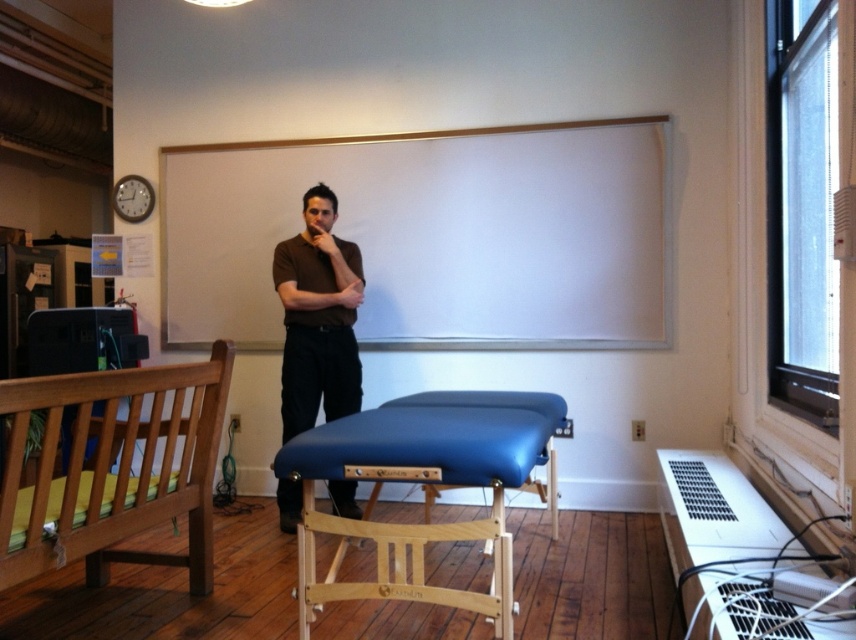
You are a physical therapist trying to adjust the position of your patient. The patient is wearing a dark brown shirt at center and has a matte brown arm at center. You need to ensure that the distance between them is exactly 3 inches for proper alignment. Is the current distance sufficient?

The distance between the dark brown shirt at center and the matte brown arm at center is currently 2.57 inches, which is slightly less than the required 3 inches. Adjust the position to increase the distance for proper alignment.

You are a physical therapist entering the room and need to move the blue fabric massage table at center so that it doesn not block the matte brown arm at center. Can you move the table to the side without moving the arm?

The blue fabric massage table at center is in front of the matte brown arm at center, so moving it to the side would allow the arm to be visible and unobstructed.